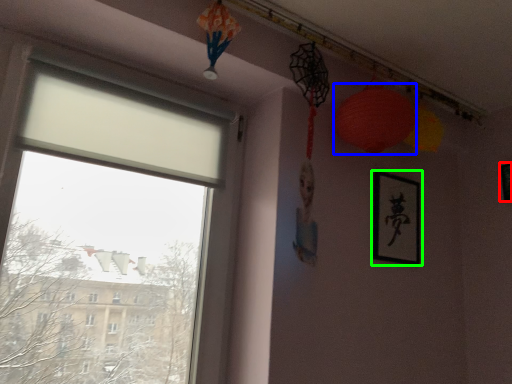
Question: Which is nearer to the picture frame (highlighted by a red box)? lantern (highlighted by a blue box) or picture frame (highlighted by a green box).

Choices:
 (A) lantern
 (B) picture frame

Answer: (B)